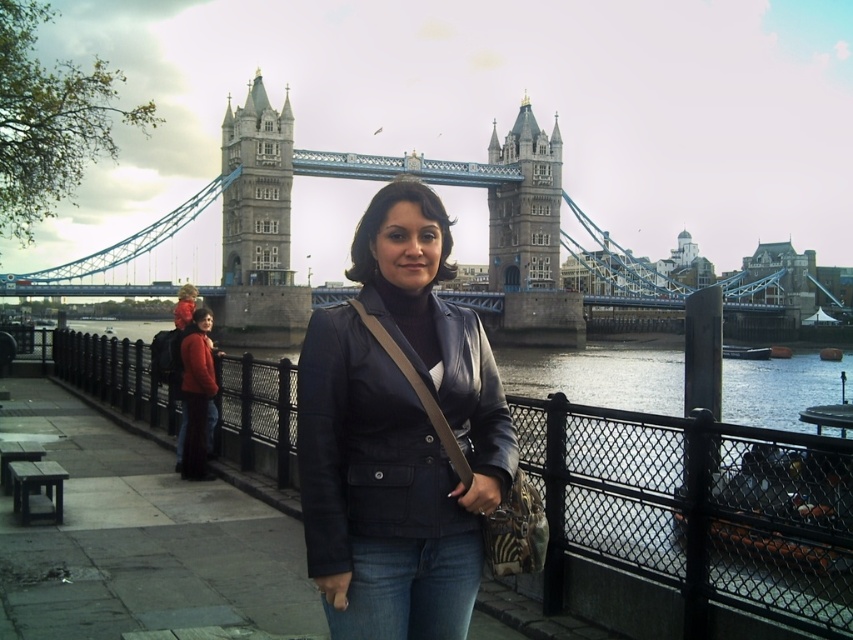
Question: Does denim jeans at center come in front of jeans at lower left?

Choices:
 (A) no
 (B) yes

Answer: (B)

Question: Which point appears farthest from the camera in this image?

Choices:
 (A) (212, 420)
 (B) (229, 257)

Answer: (B)

Question: Which object is the farthest from the stone tower at center?

Choices:
 (A) jeans at lower left
 (B) stone tower at upper center
 (C) stone gray suspension bridge at center

Answer: (A)

Question: Is stone gray suspension bridge at center thinner than denim jeans at center?

Choices:
 (A) yes
 (B) no

Answer: (B)

Question: Which object is the closest to the matte black jacket at center?

Choices:
 (A) stone tower at upper center
 (B) stone gray suspension bridge at center
 (C) jeans at lower left
 (D) stone tower at center

Answer: (C)

Question: Does stone gray suspension bridge at center have a greater width compared to jeans at lower left?

Choices:
 (A) yes
 (B) no

Answer: (A)